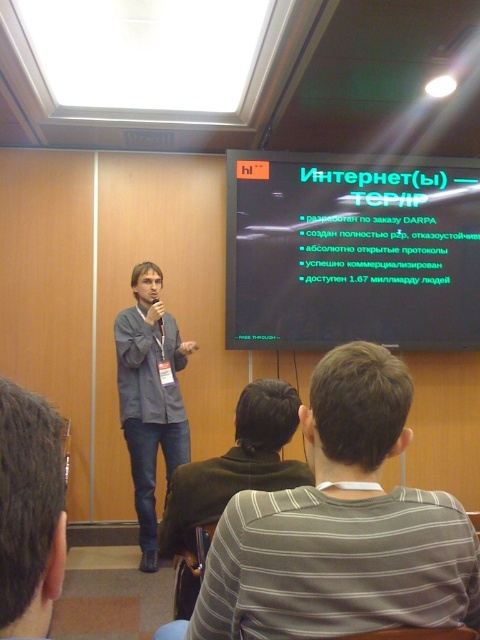
Question: Which point is farther from the camera taking this photo?

Choices:
 (A) (383, 193)
 (B) (145, 316)
 (C) (36, 403)

Answer: (A)

Question: Does dark brown hair at upper center appear over denim jeans at center?

Choices:
 (A) yes
 (B) no

Answer: (A)

Question: Is green matte projection screen at upper center in front of denim jeans at center?

Choices:
 (A) no
 (B) yes

Answer: (A)

Question: Which object is closer to the camera taking this photo?

Choices:
 (A) gray striped shirt at lower right
 (B) dark brown hair at upper center
 (C) denim jeans at center

Answer: (B)

Question: Which object appears farthest from the camera in this image?

Choices:
 (A) dark brown hair at upper center
 (B) gray striped shirt at lower right

Answer: (B)

Question: Considering the relative positions of gray striped shirt at lower right and denim jeans at center in the image provided, where is gray striped shirt at lower right located with respect to denim jeans at center?

Choices:
 (A) above
 (B) below

Answer: (A)